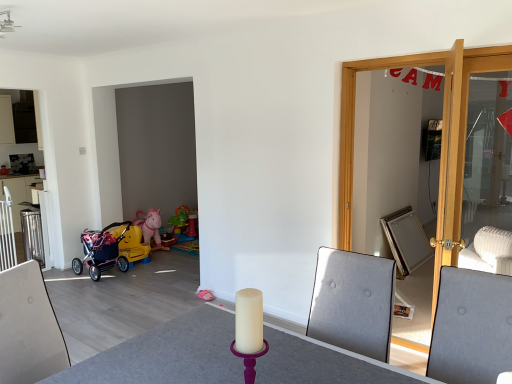
Question: Is gray fabric swivel chair at right smaller than light wood door at right?

Choices:
 (A) no
 (B) yes

Answer: (B)

Question: Does gray fabric swivel chair at right have a larger size compared to light wood door at right?

Choices:
 (A) yes
 (B) no

Answer: (B)

Question: Is the depth of gray fabric swivel chair at right less than that of light wood door at right?

Choices:
 (A) yes
 (B) no

Answer: (A)

Question: From a real-world perspective, is gray fabric swivel chair at right beneath light wood door at right?

Choices:
 (A) yes
 (B) no

Answer: (A)

Question: From a real-world perspective, is gray fabric swivel chair at right physically above light wood door at right?

Choices:
 (A) no
 (B) yes

Answer: (A)

Question: Considering the relative positions of gray fabric swivel chair at right and light wood door at right in the image provided, is gray fabric swivel chair at right to the right of light wood door at right from the viewer's perspective?

Choices:
 (A) yes
 (B) no

Answer: (B)

Question: From a real-world perspective, is matte white cabinet at upper left on pink fabric stroller at lower left?

Choices:
 (A) yes
 (B) no

Answer: (A)

Question: Is matte white cabinet at upper left positioned before pink fabric stroller at lower left?

Choices:
 (A) yes
 (B) no

Answer: (B)

Question: Would you consider matte white cabinet at upper left to be distant from pink fabric stroller at lower left?

Choices:
 (A) yes
 (B) no

Answer: (A)

Question: Can you confirm if matte white cabinet at upper left is thinner than pink fabric stroller at lower left?

Choices:
 (A) no
 (B) yes

Answer: (B)

Question: Can you confirm if matte white cabinet at upper left is shorter than pink fabric stroller at lower left?

Choices:
 (A) yes
 (B) no

Answer: (B)

Question: Is matte white cabinet at upper left facing towards pink fabric stroller at lower left?

Choices:
 (A) no
 (B) yes

Answer: (B)

Question: Is white matte round table at center not within matte white cabinet at upper left?

Choices:
 (A) yes
 (B) no

Answer: (A)